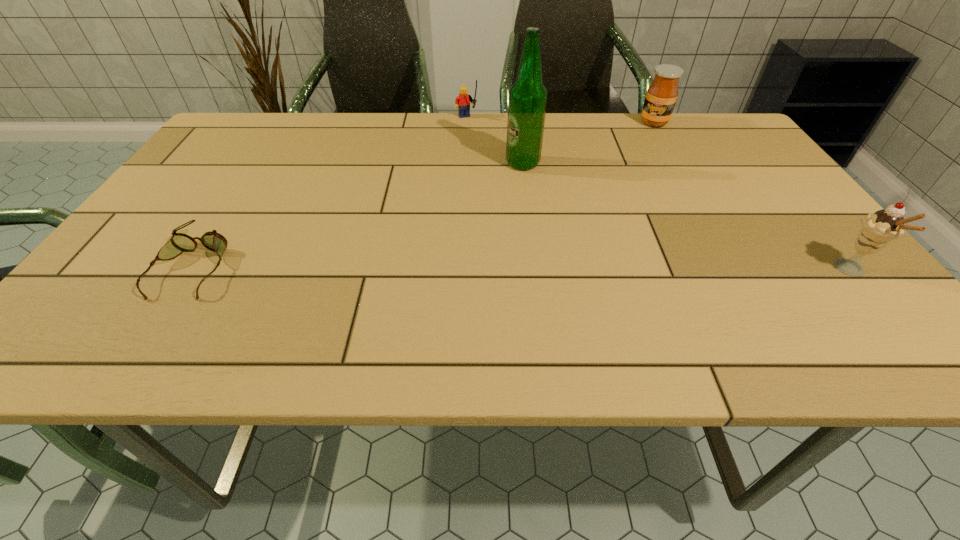
At what (x,y) coordinates should I click in order to perform the action: click on blank region between the second shortest object and the leftmost object. Please return your answer as a coordinate pair (x, y). The height and width of the screenshot is (540, 960). Looking at the image, I should click on (330, 192).

Image resolution: width=960 pixels, height=540 pixels. I want to click on empty space that is in between the fourth object from right to left and the third shortest object, so click(x=560, y=121).

At what (x,y) coordinates should I click in order to perform the action: click on vacant space that is in between the fourth tallest object and the icecream. Please return your answer as a coordinate pair (x, y). Looking at the image, I should click on (660, 195).

I want to click on free area in between the fourth object from left to right and the third object from right to left, so click(x=588, y=143).

Locate an element on the screen. The image size is (960, 540). object that can be found as the third closest to the second object from right to left is located at coordinates (879, 228).

I want to click on the third closest object to the rightmost object, so click(462, 102).